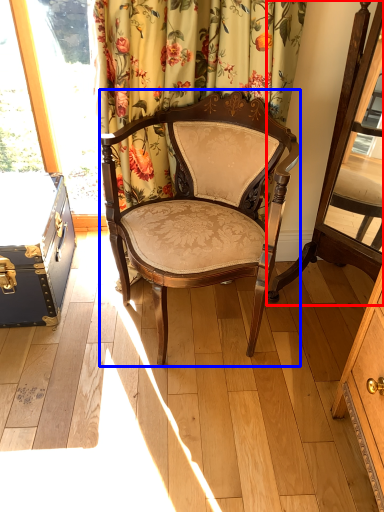
Question: Which point is further to the camera, swivel chair (highlighted by a red box) or chair (highlighted by a blue box)?

Choices:
 (A) swivel chair
 (B) chair

Answer: (B)